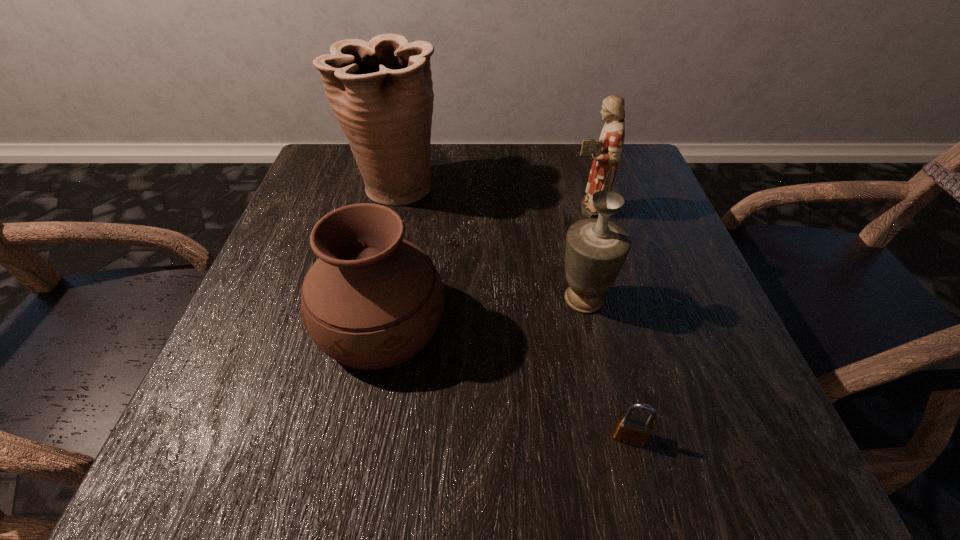
Find the location of a particular element. This screenshot has width=960, height=540. the tallest urn is located at coordinates (381, 92).

What are the coordinates of `the farthest urn` in the screenshot? It's located at (381, 92).

Find the location of a particular element. figurine is located at coordinates (606, 152).

Find the location of a particular element. This screenshot has height=540, width=960. the rightmost urn is located at coordinates (596, 248).

Image resolution: width=960 pixels, height=540 pixels. In order to click on the shortest object in this screenshot , I will do `click(633, 429)`.

I want to click on padlock, so click(x=633, y=429).

Where is `vacant area situated on the right of the tallest urn`? The height and width of the screenshot is (540, 960). vacant area situated on the right of the tallest urn is located at coordinates (589, 188).

In order to click on vacant space located 0.090m on the front-facing side of the figurine in this screenshot , I will do `click(526, 208)`.

Where is `vacant space located on the front-facing side of the figurine`? Image resolution: width=960 pixels, height=540 pixels. vacant space located on the front-facing side of the figurine is located at coordinates (395, 208).

Locate an element on the screen. free region located on the front-facing side of the figurine is located at coordinates (427, 208).